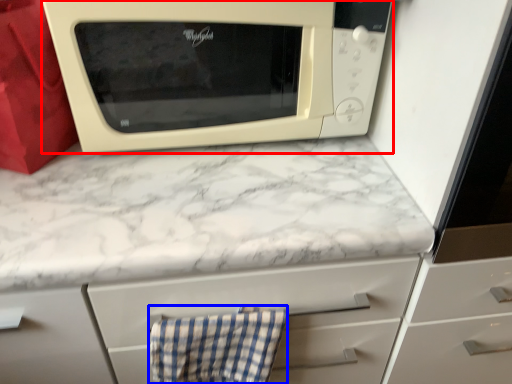
Question: Which point is closer to the camera, microwave oven (highlighted by a red box) or hand towel (highlighted by a blue box)?

Choices:
 (A) microwave oven
 (B) hand towel

Answer: (A)